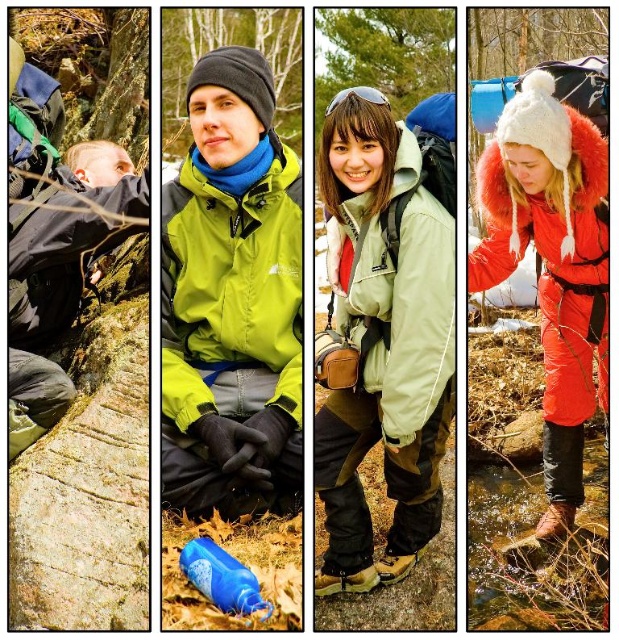
In the second panel from the left, there is a person in a bright green jacket at center and a black beanie. Where is the point located at coordinates [384,326]?

The point at coordinates [384,326] corresponds to the matte green jacket at center.

You are a hiker who wants to know if your matte green jacket at center can cover your blue matte water bottle at center completely. Based on their sizes, is this possible?

The matte green jacket at center is taller than the blue matte water bottle at center, so it can cover it completely.